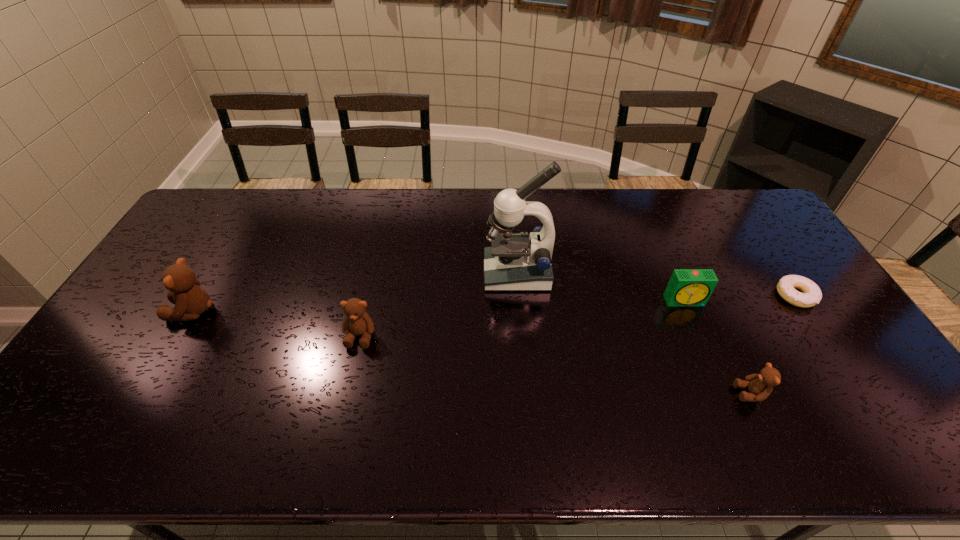
If equal spacing is the goal by inserting an additional teddy_bear among them, please point out a vacant space for this new teddy_bear. Please provide its 2D coordinates. Your answer should be formatted as a tuple, i.e. [(x, y)], where the tuple contains the x and y coordinates of a point satisfying the conditions above.

[(545, 363)]